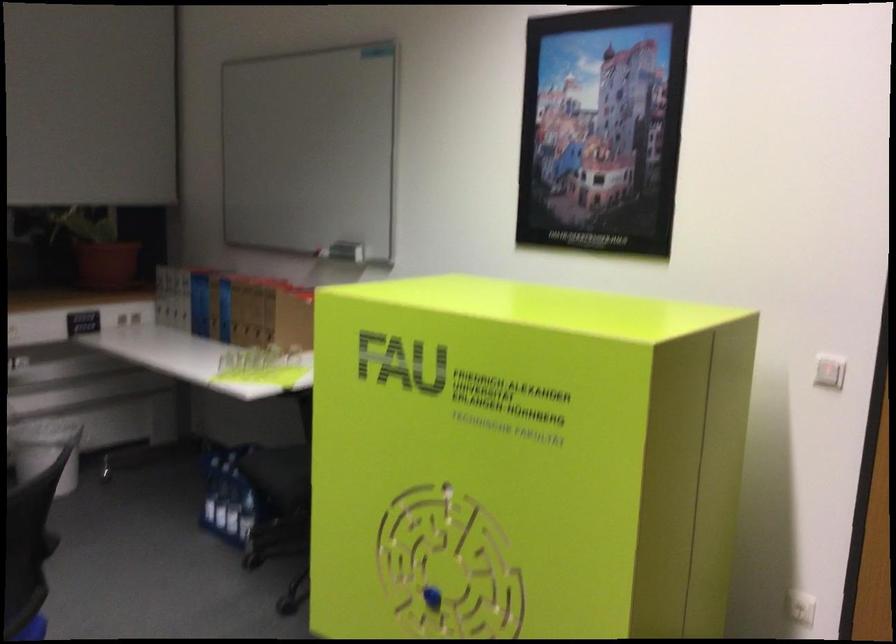
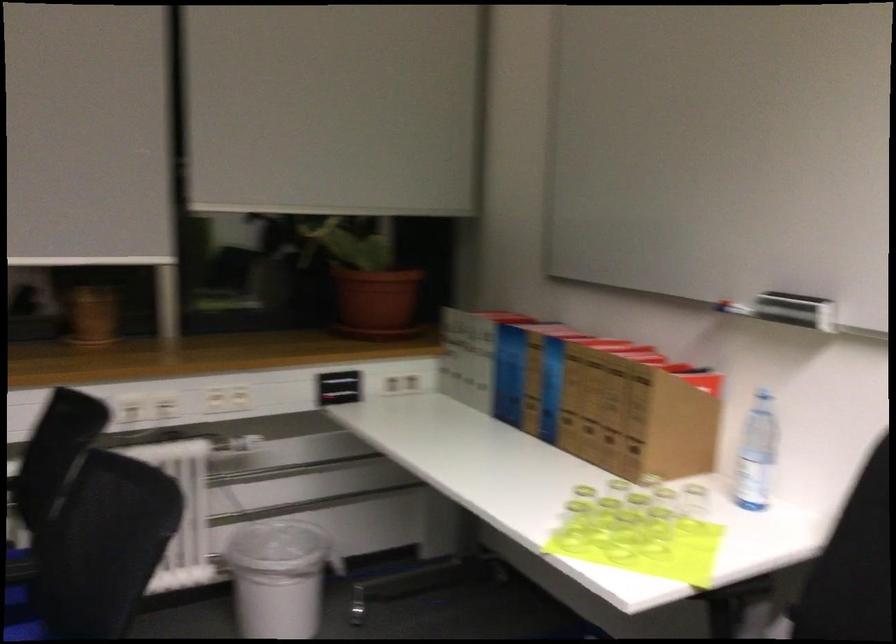
Locate, in the second image, the point that corresponds to (x=231, y=372) in the first image.

(573, 526)